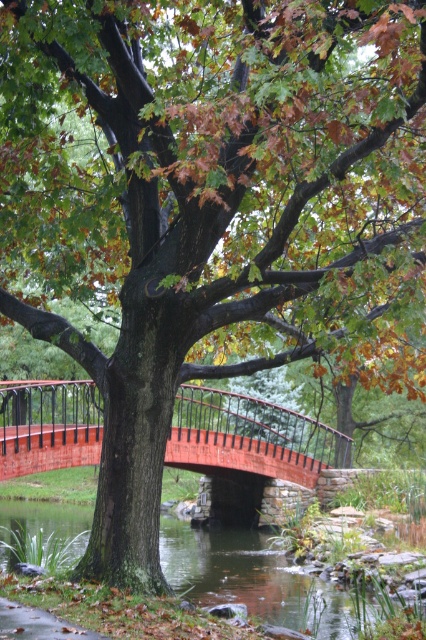
Does wooden bridge at center appear over clear water at center?

Yes, wooden bridge at center is above clear water at center.

Which is in front, point (291, 456) or point (287, 612)?

Point (287, 612) is more forward.

Which is behind, point (336, 438) or point (190, 566)?

Positioned behind is point (336, 438).

Find the location of a particular element. This screenshot has height=640, width=426. wooden bridge at center is located at coordinates (250, 436).